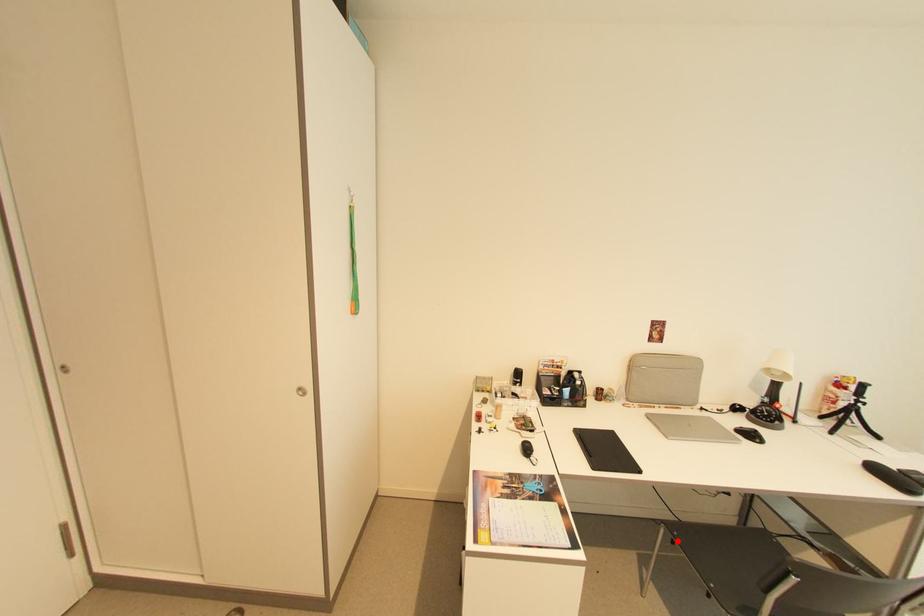
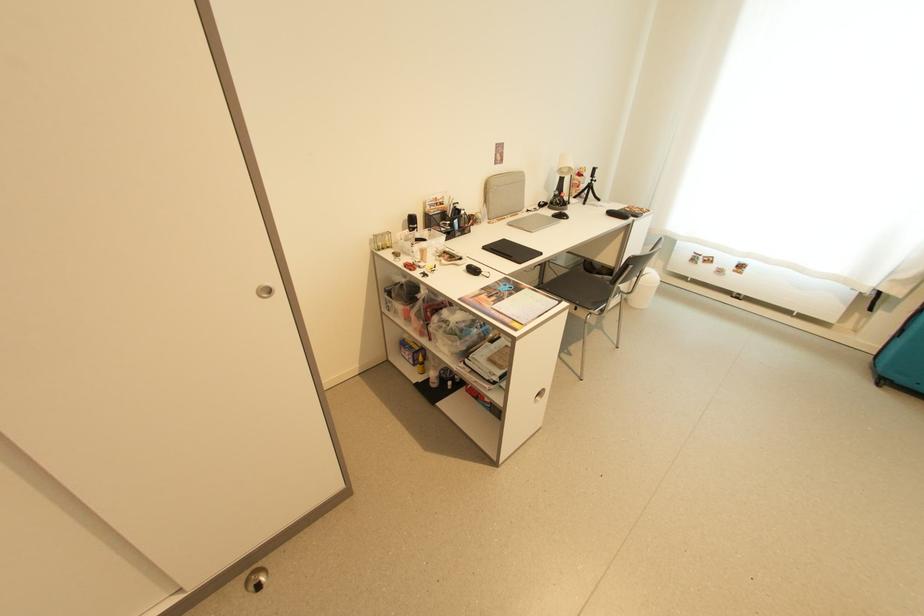
In the second image, find the point that corresponds to the highlighted location in the first image.

(552, 296)